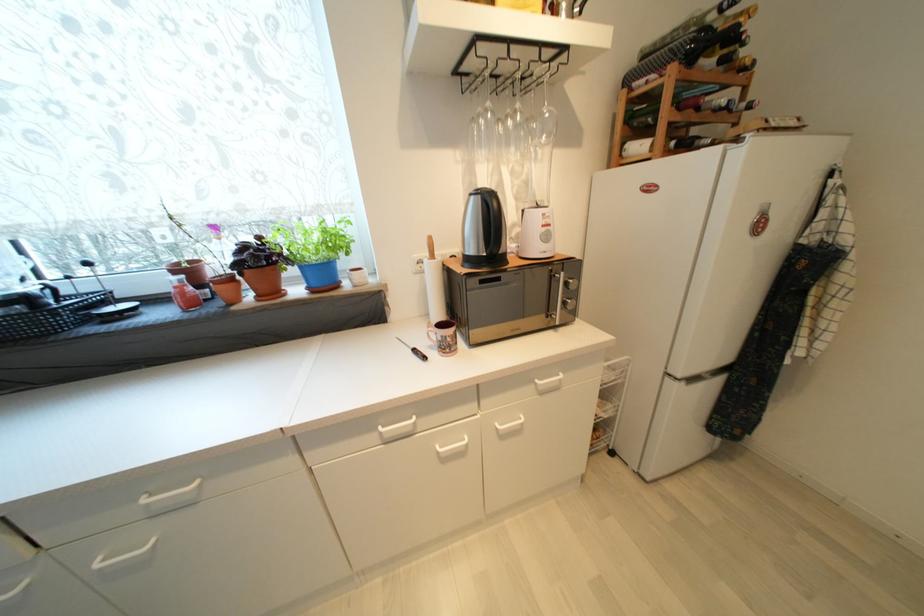
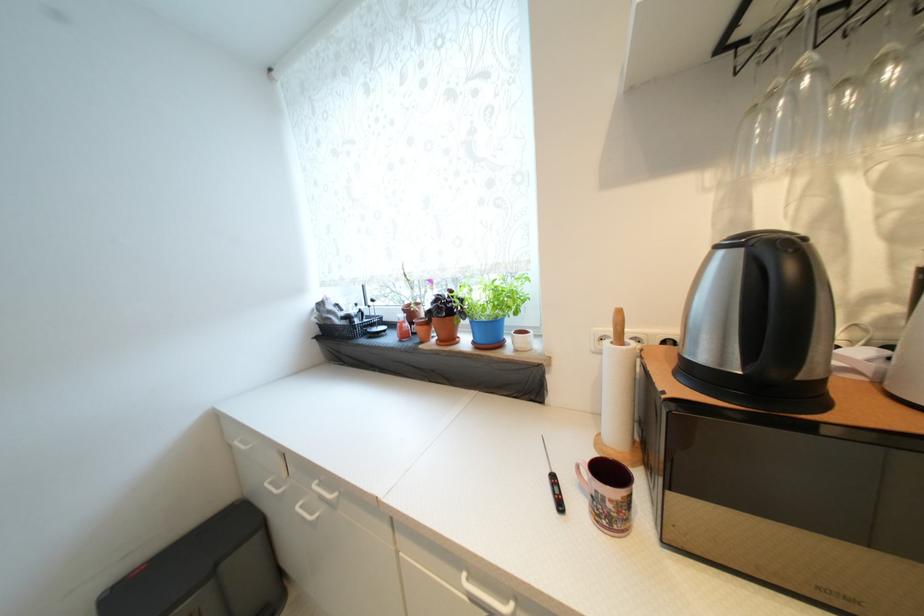
The point at (x=476, y=197) is marked in the first image. Where is the corresponding point in the second image?

(723, 249)